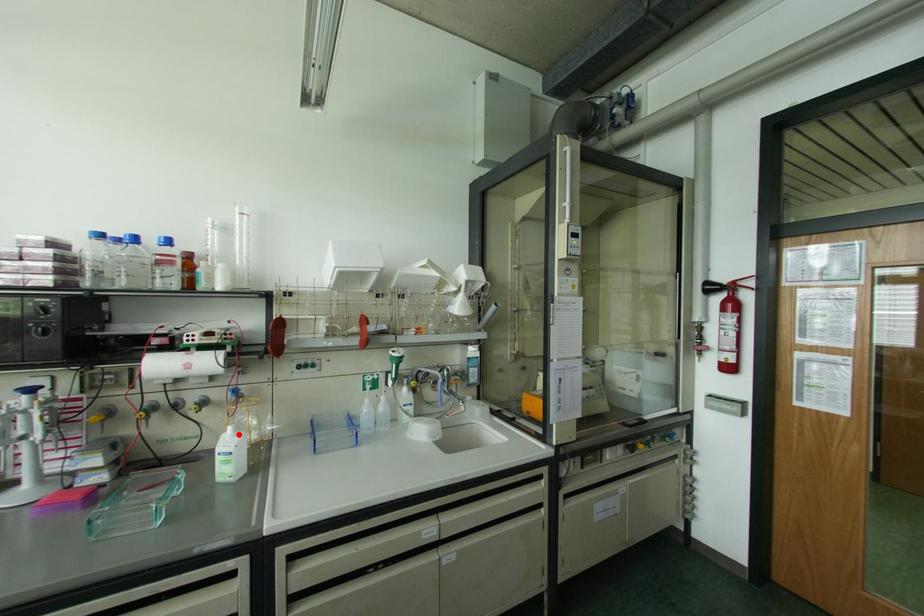
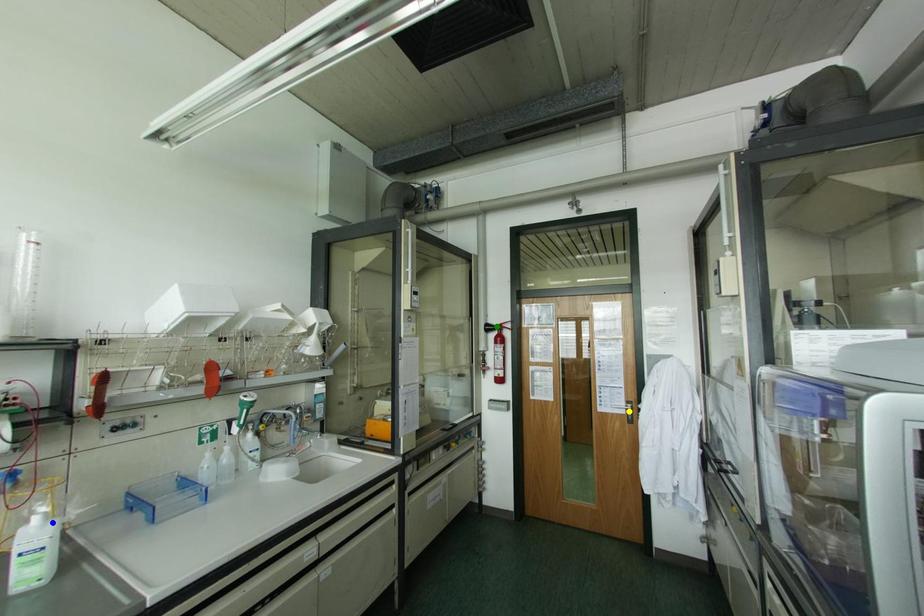
Question: I am providing you with two images of the same scene from different viewpoints. A red point is marked on the first image. You are given multiple points on the second image. Which spot in image 2 lines up with the point in image 1?

Choices:
 (A) yellow point
 (B) green point
 (C) blue point

Answer: (C)